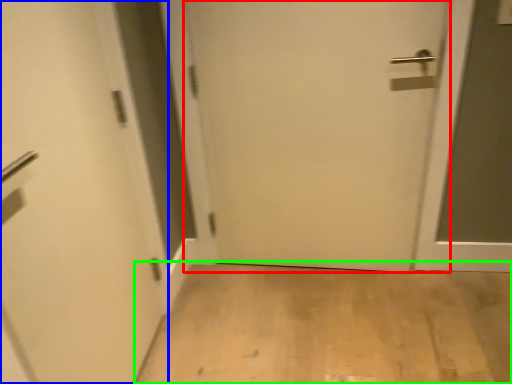
Question: Based on their relative distances, which object is nearer to door (highlighted by a red box)? Choose from door (highlighted by a blue box) and corridor (highlighted by a green box).

Choices:
 (A) door
 (B) corridor

Answer: (B)